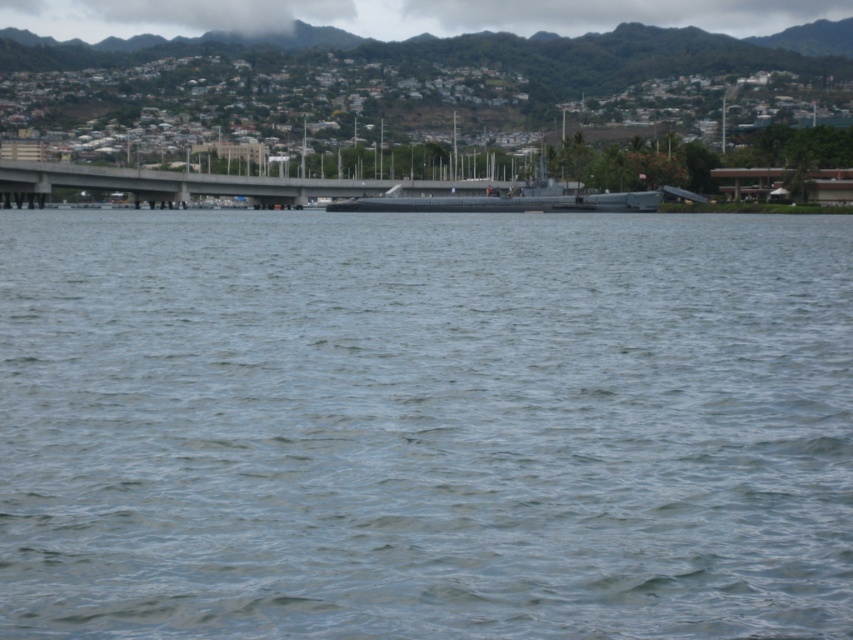
Question: Can you confirm if gray water at center is positioned to the right of concrete bridge at center?

Choices:
 (A) yes
 (B) no

Answer: (A)

Question: Does gray water at center come in front of concrete bridge at center?

Choices:
 (A) no
 (B) yes

Answer: (B)

Question: Which point is farther from the camera taking this photo?

Choices:
 (A) (376, 456)
 (B) (62, 186)

Answer: (B)

Question: Which object is closer to the camera taking this photo?

Choices:
 (A) concrete bridge at center
 (B) gray water at center

Answer: (B)

Question: Is gray water at center thinner than concrete bridge at center?

Choices:
 (A) yes
 (B) no

Answer: (A)